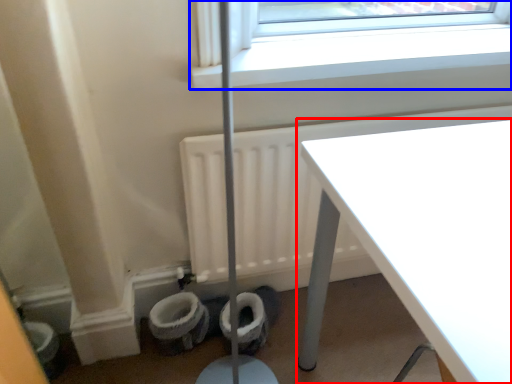
Question: Which object appears closest to the camera in this image, table (highlighted by a red box) or window (highlighted by a blue box)?

Choices:
 (A) table
 (B) window

Answer: (A)